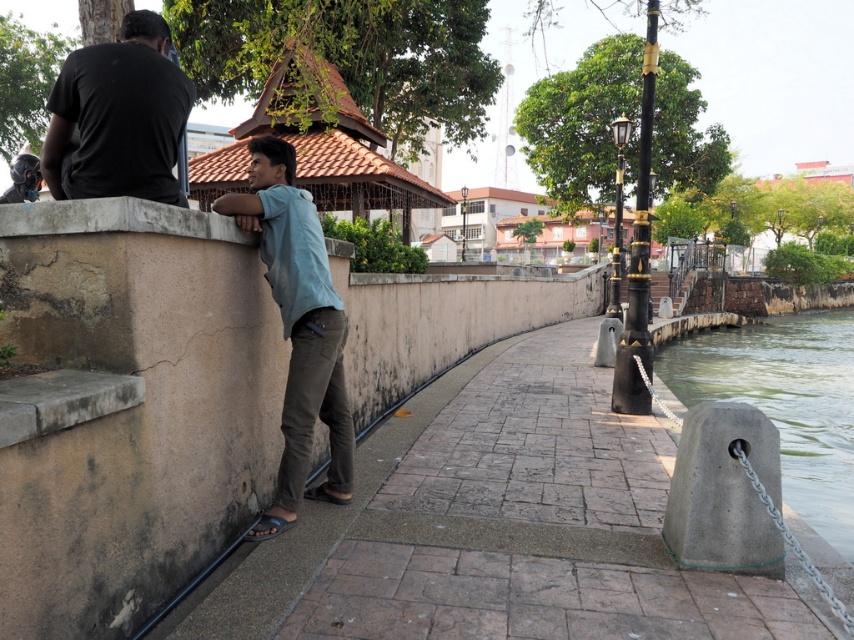
Question: Which of the following is the closest to the observer?

Choices:
 (A) gray concrete bollard at lower right
 (B) black matte shirt at upper left

Answer: (B)

Question: Which point is closer to the camera taking this photo?

Choices:
 (A) (115, 115)
 (B) (265, 212)

Answer: (A)

Question: Which point is closer to the camera?

Choices:
 (A) (847, 474)
 (B) (330, 378)

Answer: (B)

Question: From the image, what is the correct spatial relationship of gray concrete bollard at lower right in relation to black matte shirt at upper left?

Choices:
 (A) below
 (B) above

Answer: (A)

Question: Is gray concrete bollard at lower right positioned before black matte shirt at upper left?

Choices:
 (A) no
 (B) yes

Answer: (A)

Question: Is light blue fabric shirt at center positioned before black matte shirt at upper left?

Choices:
 (A) yes
 (B) no

Answer: (B)